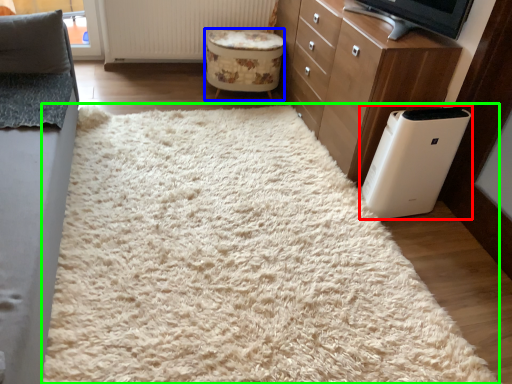
Question: Estimate the real-world distances between objects in this image. Which object is closer to home appliance (highlighted by a red box), stool (highlighted by a blue box) or mat (highlighted by a green box)?

Choices:
 (A) stool
 (B) mat

Answer: (B)